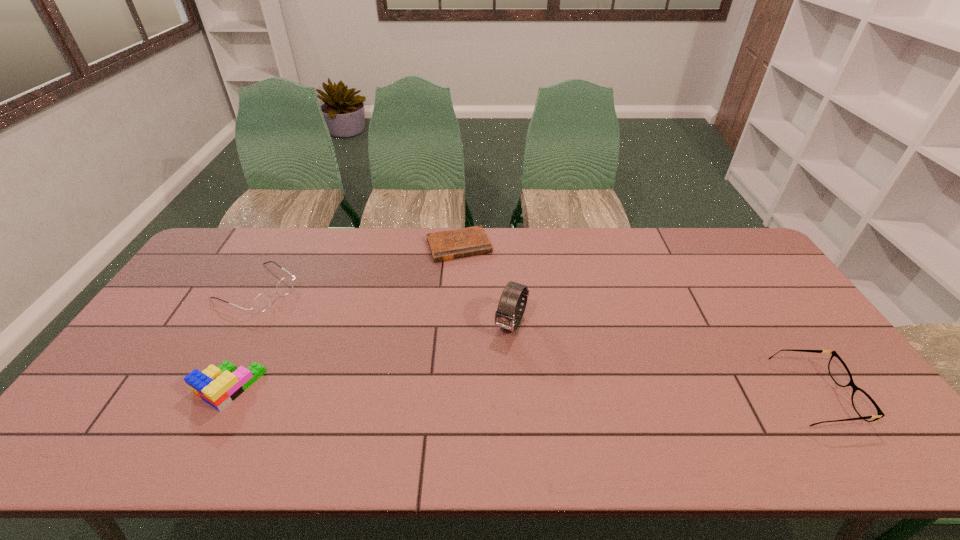
Identify the location of spectacles that is at the near edge. (864, 405).

Where is `object situated at the left edge`? This screenshot has width=960, height=540. object situated at the left edge is located at coordinates (262, 301).

Where is `object present at the right edge`? object present at the right edge is located at coordinates (864, 405).

Identify the location of object located at the far left corner. (262, 301).

Image resolution: width=960 pixels, height=540 pixels. Find the location of `object at the near right corner`. object at the near right corner is located at coordinates (864, 405).

Image resolution: width=960 pixels, height=540 pixels. I want to click on vacant region at the far edge, so click(x=291, y=246).

What are the coordinates of `free space at the near edge` in the screenshot? It's located at (669, 391).

At what (x,y) coordinates should I click in order to perform the action: click on free space at the left edge of the desktop. Please return your answer as a coordinate pair (x, y). Image resolution: width=960 pixels, height=540 pixels. Looking at the image, I should click on (132, 363).

You are a GUI agent. You are given a task and a screenshot of the screen. Output one action in this format:
    pyautogui.click(x=<x>, y=<y>)
    Task: Click on the vacant space at the right edge of the desktop
    The image size is (960, 540).
    Given the screenshot: What is the action you would take?
    pyautogui.click(x=772, y=339)

Locate an element on the screen. This screenshot has height=540, width=960. empty space between the left spectacles and the shortest object is located at coordinates (358, 268).